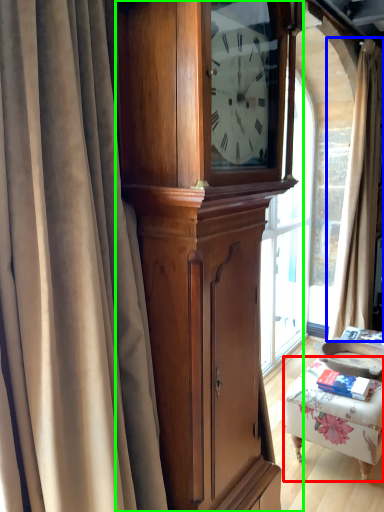
Question: Estimate the real-world distances between objects in this image. Which object is closer to furniture (highlighted by a red box), curtain (highlighted by a blue box) or cabinetry (highlighted by a green box)?

Choices:
 (A) curtain
 (B) cabinetry

Answer: (B)